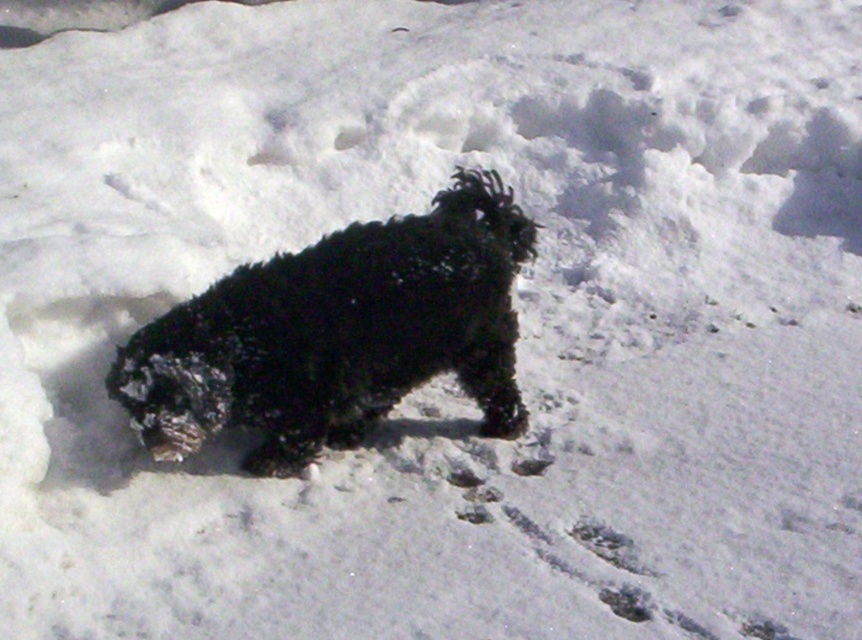
Question: Does black fluffy dog at center appear on the left side of white powdery snow at center?

Choices:
 (A) yes
 (B) no

Answer: (A)

Question: Can you confirm if black fluffy dog at center is smaller than white powdery snow at center?

Choices:
 (A) no
 (B) yes

Answer: (A)

Question: Which object appears closest to the camera in this image?

Choices:
 (A) black fluffy dog at center
 (B) white powdery snow at center

Answer: (B)

Question: Is the position of black fluffy dog at center more distant than that of white powdery snow at center?

Choices:
 (A) yes
 (B) no

Answer: (A)

Question: Which object is farther from the camera taking this photo?

Choices:
 (A) black fluffy dog at center
 (B) white powdery snow at center

Answer: (A)